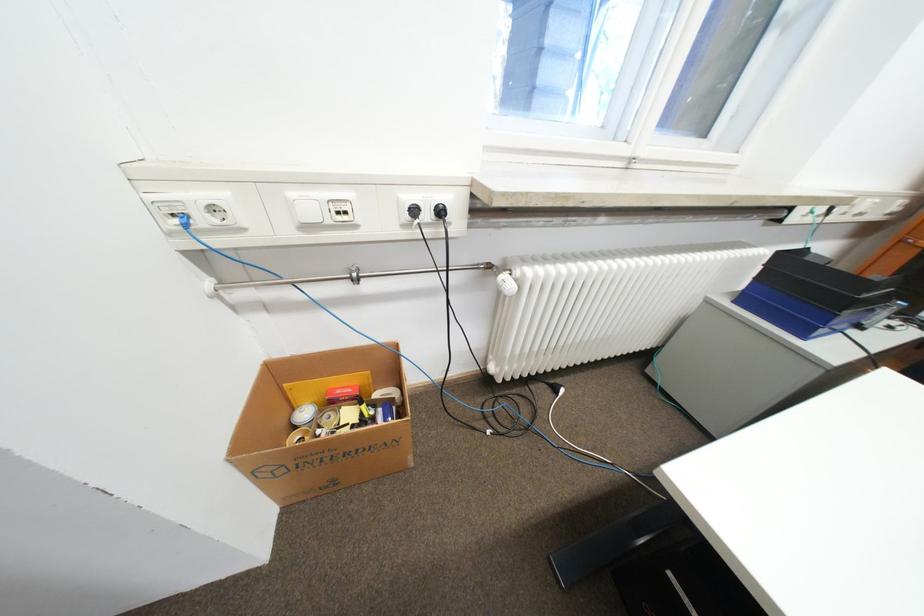
The location [319,426] corresponds to which object?

This point indicates the large cardboard box.